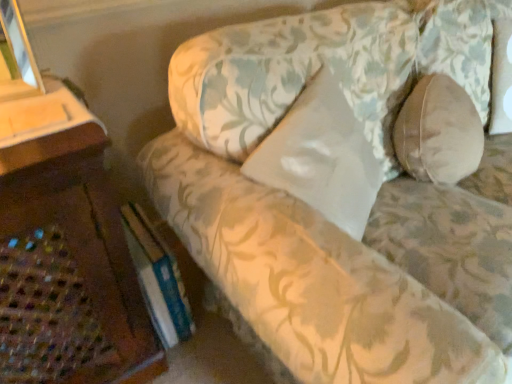
What is the approximate height of white satin pillow at center, which is the second pillow in right-to-left order?

22.74 inches.

Measure the distance between floral fabric couch at center and camera.

floral fabric couch at center is 22.96 inches away from camera.

You are a GUI agent. You are given a task and a screenshot of the screen. Output one action in this format:
    pyautogui.click(x=<x>, y=<y>)
    Task: Click on the white satin pillow at center, acting as the first pillow starting from the left
    
    Given the screenshot: What is the action you would take?
    pyautogui.click(x=321, y=156)

Considering the relative sizes of white satin pillow at center, acting as the first pillow starting from the left, and beige fabric pillow at right, the second pillow from the left, in the image provided, is white satin pillow at center, acting as the first pillow starting from the left, bigger than beige fabric pillow at right, the second pillow from the left,?

Incorrect, white satin pillow at center, acting as the first pillow starting from the left, is not larger than beige fabric pillow at right, the second pillow from the left.

Is beige fabric pillow at right, the first pillow positioned from the right, at the back of white satin pillow at center, acting as the first pillow starting from the left?

No, beige fabric pillow at right, the first pillow positioned from the right, is not at the back of white satin pillow at center, acting as the first pillow starting from the left.

From the image's perspective, who appears lower, white satin pillow at center, acting as the first pillow starting from the left, or beige fabric pillow at right, the first pillow positioned from the right?

white satin pillow at center, acting as the first pillow starting from the left, from the image's perspective.

How much distance is there between white satin pillow at center, which is the second pillow in right-to-left order, and beige fabric pillow at right, the second pillow from the left?

The distance of white satin pillow at center, which is the second pillow in right-to-left order, from beige fabric pillow at right, the second pillow from the left, is 21.59 inches.

Visually, is white satin pillow at center, which is the second pillow in right-to-left order, positioned to the left or to the right of floral fabric couch at center?

In the image, white satin pillow at center, which is the second pillow in right-to-left order, appears on the left side of floral fabric couch at center.

Does point (354, 147) come in front of point (180, 176)?

No, (354, 147) is behind (180, 176).

How distant is white satin pillow at center, acting as the first pillow starting from the left, from floral fabric couch at center?

They are 4.84 inches apart.

Is white satin pillow at center, acting as the first pillow starting from the left, next to floral fabric couch at center?

No, white satin pillow at center, acting as the first pillow starting from the left, is not touching floral fabric couch at center.

Between hardcover book at lower left and beige fabric pillow at right, the first pillow positioned from the right, which one has smaller width?

With smaller width is hardcover book at lower left.

Considering the sizes of objects hardcover book at lower left and beige fabric pillow at right, the first pillow positioned from the right, in the image provided, who is bigger, hardcover book at lower left or beige fabric pillow at right, the first pillow positioned from the right,?

beige fabric pillow at right, the first pillow positioned from the right.

Is there a large distance between hardcover book at lower left and beige fabric pillow at right, the second pillow from the left?

Yes, hardcover book at lower left and beige fabric pillow at right, the second pillow from the left, are located far from each other.

From a real-world perspective, is hardcover book at lower left on beige fabric pillow at right, the second pillow from the left?

No, from a real-world perspective, hardcover book at lower left is not over beige fabric pillow at right, the second pillow from the left

From a real-world perspective, is beige fabric pillow at right, the first pillow positioned from the right, positioned under white satin pillow at center, which is the second pillow in right-to-left order, based on gravity?

Yes, from a real-world perspective, beige fabric pillow at right, the first pillow positioned from the right, is below white satin pillow at center, which is the second pillow in right-to-left order.

Is beige fabric pillow at right, the first pillow positioned from the right, aimed at white satin pillow at center, which is the second pillow in right-to-left order?

No.

Where is `pillow behind the white satin pillow at center, which is the second pillow in right-to-left order`? This screenshot has width=512, height=384. pillow behind the white satin pillow at center, which is the second pillow in right-to-left order is located at coordinates (460, 47).

Considering the relative sizes of beige fabric pillow at right, the second pillow from the left, and white satin pillow at center, which is the second pillow in right-to-left order, in the image provided, is beige fabric pillow at right, the second pillow from the left, thinner than white satin pillow at center, which is the second pillow in right-to-left order,?

In fact, beige fabric pillow at right, the second pillow from the left, might be wider than white satin pillow at center, which is the second pillow in right-to-left order.

Which is more to the left, white satin pillow at center, acting as the first pillow starting from the left, or hardcover book at lower left?

From the viewer's perspective, hardcover book at lower left appears more on the left side.

Considering the relative sizes of white satin pillow at center, which is the second pillow in right-to-left order, and hardcover book at lower left in the image provided, is white satin pillow at center, which is the second pillow in right-to-left order, smaller than hardcover book at lower left?

Actually, white satin pillow at center, which is the second pillow in right-to-left order, might be larger than hardcover book at lower left.

Is white satin pillow at center, acting as the first pillow starting from the left, not close to hardcover book at lower left?

That's not correct — white satin pillow at center, acting as the first pillow starting from the left, is a little close to hardcover book at lower left.

Would you say hardcover book at lower left is part of white satin pillow at center, acting as the first pillow starting from the left,'s contents?

No, white satin pillow at center, acting as the first pillow starting from the left, does not contain hardcover book at lower left.

Considering the points (150, 292) and (281, 301), which point is in front, point (150, 292) or point (281, 301)?

The point (281, 301) is closer.

Is hardcover book at lower left positioned with its back to floral fabric couch at center?

Yes, floral fabric couch at center is at the back of hardcover book at lower left.

Is hardcover book at lower left inside or outside of floral fabric couch at center?

hardcover book at lower left is enclosed within floral fabric couch at center.

How many degrees apart are the facing directions of hardcover book at lower left and white satin pillow at center, acting as the first pillow starting from the left?

They differ by 37.6 degrees in their facing directions.

Is hardcover book at lower left thinner than white satin pillow at center, which is the second pillow in right-to-left order?

No.

From the image's perspective, who appears lower, hardcover book at lower left or white satin pillow at center, acting as the first pillow starting from the left?

hardcover book at lower left is shown below in the image.

Considering the sizes of hardcover book at lower left and white satin pillow at center, which is the second pillow in right-to-left order, in the image, is hardcover book at lower left bigger or smaller than white satin pillow at center, which is the second pillow in right-to-left order,?

hardcover book at lower left is smaller than white satin pillow at center, which is the second pillow in right-to-left order.

The height and width of the screenshot is (384, 512). Identify the location of pillow on the right of white satin pillow at center, which is the second pillow in right-to-left order. (460, 47).

What are the coordinates of `studio couch in front of the white satin pillow at center, acting as the first pillow starting from the left` in the screenshot? It's located at (327, 192).

Based on their spatial positions, is white satin pillow at center, which is the second pillow in right-to-left order, or floral fabric couch at center further from beige fabric pillow at right, the first pillow positioned from the right?

white satin pillow at center, which is the second pillow in right-to-left order, is further to beige fabric pillow at right, the first pillow positioned from the right.

When comparing their distances from beige fabric pillow at right, the first pillow positioned from the right, does hardcover book at lower left or floral fabric couch at center seem closer?

Based on the image, floral fabric couch at center appears to be nearer to beige fabric pillow at right, the first pillow positioned from the right.

Consider the image. When comparing their distances from hardcover book at lower left, does beige fabric pillow at right, the first pillow positioned from the right, or white satin pillow at center, acting as the first pillow starting from the left, seem further?

Among the two, beige fabric pillow at right, the first pillow positioned from the right, is located further to hardcover book at lower left.

Considering their positions, is beige fabric pillow at right, the second pillow from the left, positioned further to white satin pillow at center, which is the second pillow in right-to-left order, than floral fabric couch at center?

beige fabric pillow at right, the second pillow from the left, lies further to white satin pillow at center, which is the second pillow in right-to-left order, than the other object.

From the image, which object appears to be nearer to hardcover book at lower left, floral fabric couch at center or beige fabric pillow at right, the first pillow positioned from the right?

floral fabric couch at center.

Considering their positions, is hardcover book at lower left positioned closer to white satin pillow at center, acting as the first pillow starting from the left, than beige fabric pillow at right, the first pillow positioned from the right?

Based on the image, hardcover book at lower left appears to be nearer to white satin pillow at center, acting as the first pillow starting from the left.

From the image, which object appears to be nearer to floral fabric couch at center, hardcover book at lower left or beige fabric pillow at right, the first pillow positioned from the right?

The object closer to floral fabric couch at center is beige fabric pillow at right, the first pillow positioned from the right.

Estimate the real-world distances between objects in this image. Which object is closer to floral fabric couch at center, white satin pillow at center, acting as the first pillow starting from the left, or hardcover book at lower left?

white satin pillow at center, acting as the first pillow starting from the left, is positioned closer to the anchor floral fabric couch at center.

This screenshot has height=384, width=512. I want to click on pillow between hardcover book at lower left and floral fabric couch at center, so click(321, 156).

You are a GUI agent. You are given a task and a screenshot of the screen. Output one action in this format:
    pyautogui.click(x=<x>, y=<y>)
    Task: Click on the pillow between hardcover book at lower left and beige fabric pillow at right, the second pillow from the left, from left to right
    This screenshot has width=512, height=384.
    Given the screenshot: What is the action you would take?
    pyautogui.click(x=321, y=156)

Find the location of a particular element. The image size is (512, 384). pillow positioned between floral fabric couch at center and beige fabric pillow at right, the first pillow positioned from the right, from near to far is located at coordinates (321, 156).

Image resolution: width=512 pixels, height=384 pixels. What are the coordinates of `studio couch between hardcover book at lower left and beige fabric pillow at right, the first pillow positioned from the right, from left to right` in the screenshot? It's located at (327, 192).